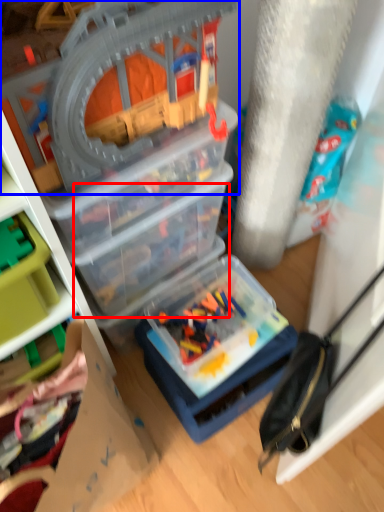
Question: Which of the following is the closest to the observer, box (highlighted by a red box) or toy (highlighted by a blue box)?

Choices:
 (A) box
 (B) toy

Answer: (B)